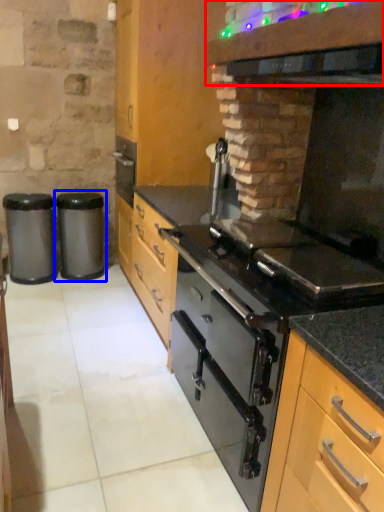
Question: Which of the following is the farthest to the observer, vent (highlighted by a red box) or waste container (highlighted by a blue box)?

Choices:
 (A) vent
 (B) waste container

Answer: (B)